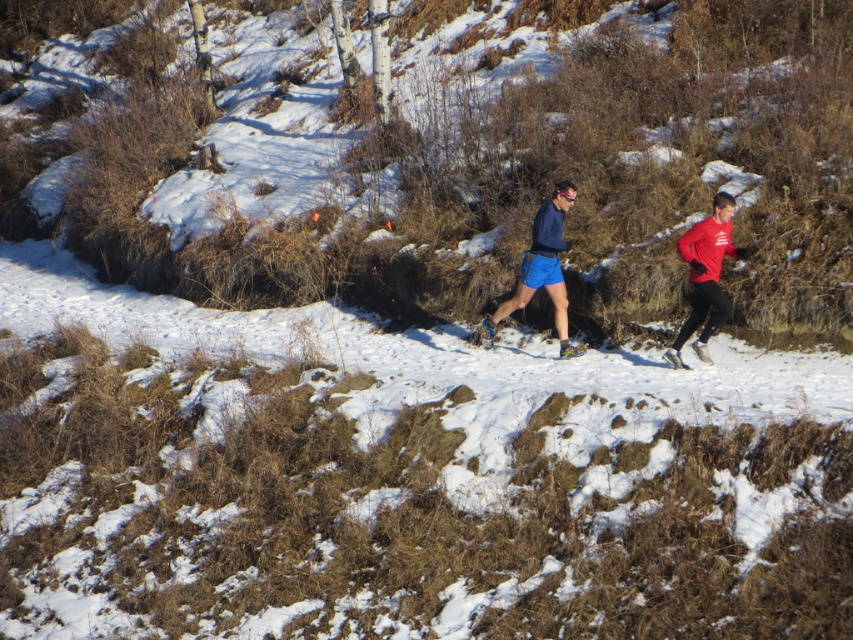
Is point (688, 332) positioned before point (692, 332)?

Yes, it is in front of point (692, 332).

Who is more distant from viewer, [531,256] or [682,368]?

Positioned behind is point [531,256].

Does point (722, 195) come in front of point (704, 248)?

No.

Where is `matte blue shorts at center`? The width and height of the screenshot is (853, 640). matte blue shorts at center is located at coordinates pos(706,275).

Does matte blue shorts at center have a larger size compared to blue matte shorts at center?

Incorrect, matte blue shorts at center is not larger than blue matte shorts at center.

Between point (521, 272) and point (564, 198), which one is positioned in front?

Point (564, 198)

Where is `matte blue shorts at center`? matte blue shorts at center is located at coordinates (706, 275).

Between point (712, 230) and point (560, 248), which one is positioned in front?

Point (712, 230) is in front.

Describe the element at coordinates (705, 276) in the screenshot. I see `red matte running suit at right` at that location.

At what (x,y) coordinates should I click in order to perform the action: click on red matte running suit at right. Please return your answer as a coordinate pair (x, y). Looking at the image, I should click on (705, 276).